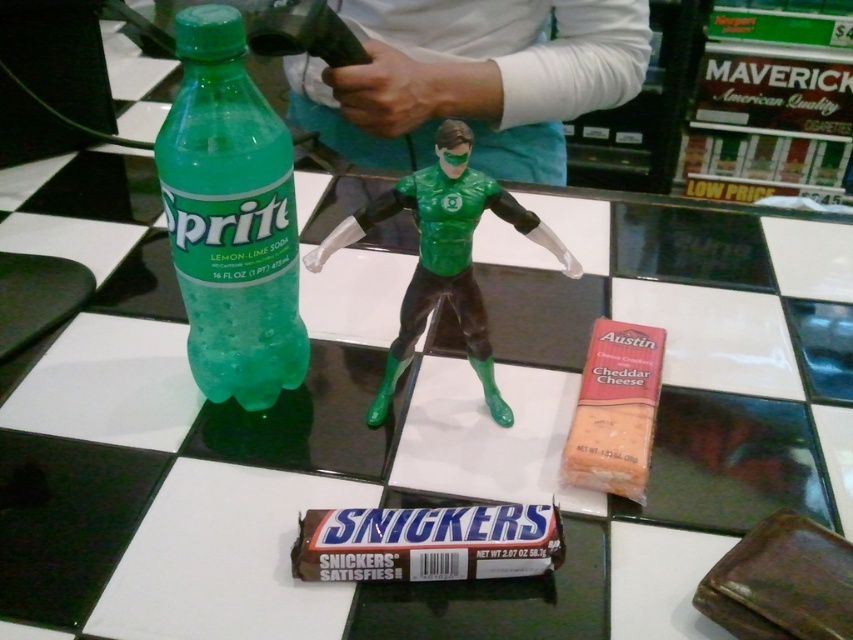
Based on the photo, you have a small box that can only fit items wider than the translucent green plastic bottle at left. Can the green plastic toy at center fit inside the box?

The green plastic toy at center is wider than the translucent green plastic bottle at left, so it can fit inside the box designed for items wider than the bottle.

You are a robot arm trying to pick up the green matte figure at center. There is a translucent green plastic bottle at left in the way. Can you reach the figure without moving the bottle?

The translucent green plastic bottle at left is closer to the viewer than the green matte figure at center, so the robot arm can reach around or over the bottle to access the figure without moving it.

You are organizing a picnic basket and want to place the chocolate brown candy bar at lower center and the brown cardboard snickers bar at lower center next to each other. Given their distance apart, will they fit side by side in a space that is 10 inches wide?

The chocolate brown candy bar at lower center and the brown cardboard snickers bar at lower center are 5.28 inches apart. Since the space is 10 inches wide, they can fit side by side as the combined width would be less than 10 inches.